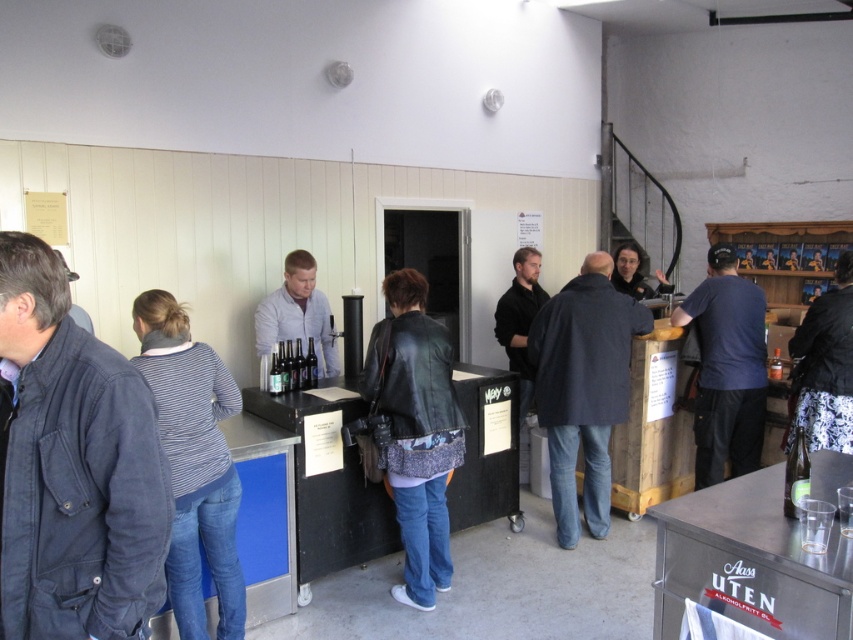
Question: Which of the following is the farthest from the observer?

Choices:
 (A) dark gray coat at center
 (B) black leather jacket at right
 (C) striped cotton shirt at center
 (D) dark brown leather jacket at center

Answer: (D)

Question: Can you confirm if dark gray coat at center is positioned to the right of black leather jacket at right?

Choices:
 (A) yes
 (B) no

Answer: (B)

Question: Is black leather jacket at center positioned behind black matte jacket at center?

Choices:
 (A) no
 (B) yes

Answer: (A)

Question: Is denim jacket at left positioned behind dark brown leather jacket at center?

Choices:
 (A) yes
 (B) no

Answer: (B)

Question: Which point is closer to the camera taking this photo?

Choices:
 (A) (279, 387)
 (B) (602, 376)
 (C) (229, 372)

Answer: (C)

Question: Which is nearer to the black matte jacket at center?

Choices:
 (A) dark gray coat at center
 (B) denim jacket at left
 (C) light gray sweater at center

Answer: (A)